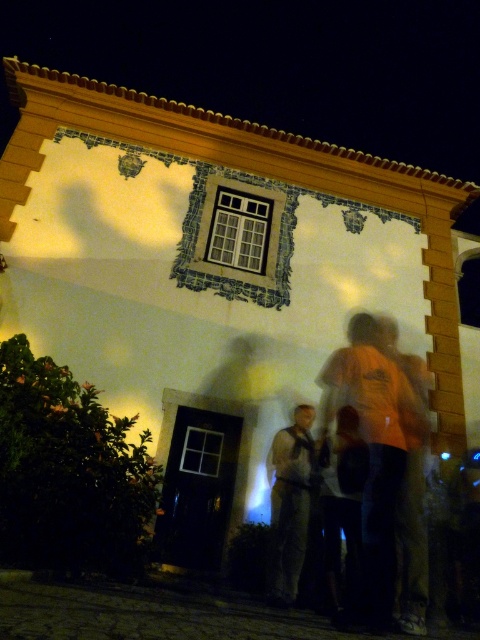
Question: Which point is farther to the camera?

Choices:
 (A) (297, 410)
 (B) (395, 520)

Answer: (A)

Question: From the image, what is the correct spatial relationship of orange t-shirt at right in relation to camouflage fabric shirt at center?

Choices:
 (A) left
 (B) right

Answer: (B)

Question: Among these objects, which one is nearest to the camera?

Choices:
 (A) camouflage fabric shirt at center
 (B) orange t-shirt at right

Answer: (B)

Question: Can you confirm if orange t-shirt at right is positioned to the right of camouflage fabric shirt at center?

Choices:
 (A) no
 (B) yes

Answer: (B)

Question: Among these objects, which one is farthest from the camera?

Choices:
 (A) orange t-shirt at right
 (B) camouflage fabric shirt at center

Answer: (B)

Question: Does orange t-shirt at right appear under camouflage fabric shirt at center?

Choices:
 (A) yes
 (B) no

Answer: (B)